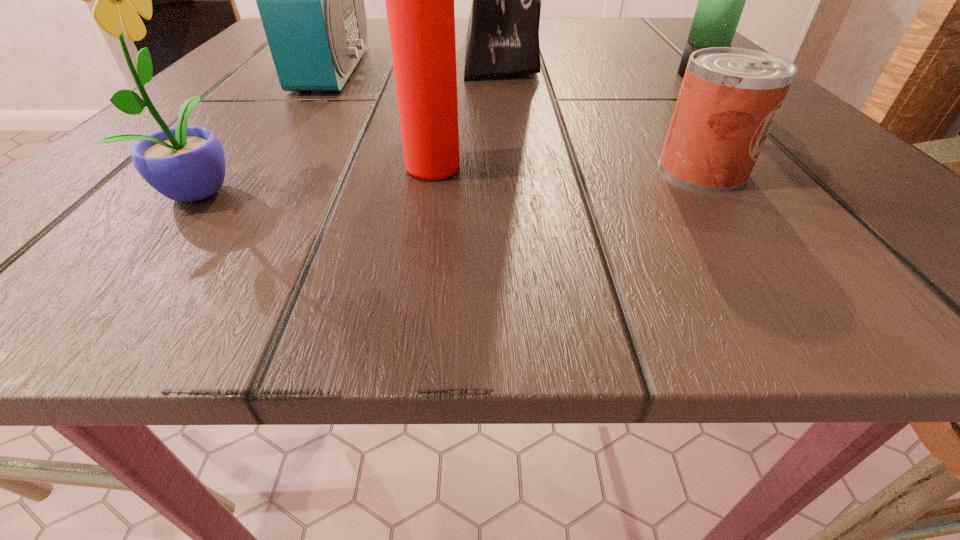
In order to click on the tallest object in this screenshot , I will do (x=503, y=31).

This screenshot has height=540, width=960. What are the coordinates of `the second tallest object` in the screenshot? It's located at (311, 0).

Image resolution: width=960 pixels, height=540 pixels. Find the location of `the farther thermos bottle`. the farther thermos bottle is located at coordinates (721, 1).

Locate an element on the screen. The width and height of the screenshot is (960, 540). the rightmost object is located at coordinates (721, 1).

I want to click on the nearer thermos bottle, so click(x=419, y=0).

Locate an element on the screen. Image resolution: width=960 pixels, height=540 pixels. sunflower is located at coordinates (185, 163).

Locate an element on the screen. This screenshot has width=960, height=540. the shortest object is located at coordinates (729, 98).

Identify the location of can. Image resolution: width=960 pixels, height=540 pixels. (729, 98).

I want to click on vacant position located on the front of the shopping bag with the design, so click(383, 52).

Locate an element on the screen. free space located on the front of the shopping bag with the design is located at coordinates (348, 52).